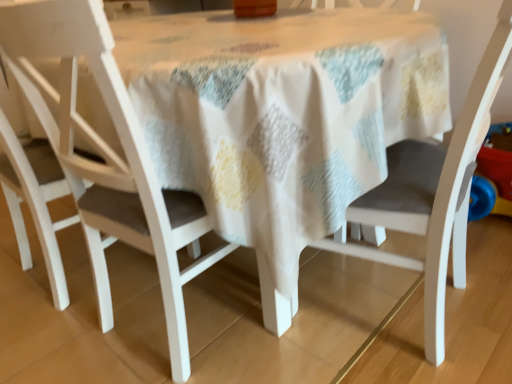
Question: Based on their sizes in the image, would you say matte white chair at center, the second chair in the left-to-right sequence, is bigger or smaller than white matte chair at left, positioned as the first chair in left-to-right order?

Choices:
 (A) small
 (B) big

Answer: (B)

Question: From their relative heights in the image, would you say matte white chair at center, the second chair in the left-to-right sequence, is taller or shorter than white matte chair at left, positioned as the first chair in left-to-right order?

Choices:
 (A) short
 (B) tall

Answer: (B)

Question: Which of these objects is positioned farthest from the matte white chair at center, the second chair in the left-to-right sequence?

Choices:
 (A) white matte chair at left, positioned as the first chair in left-to-right order
 (B) white matte chair at center, which is the 3th chair from left to right

Answer: (B)

Question: Which object is positioned closest to the white matte chair at center, which is the 3th chair from left to right?

Choices:
 (A) white matte chair at left, arranged as the third chair when viewed from the right
 (B) matte white chair at center, the second chair in the left-to-right sequence

Answer: (B)